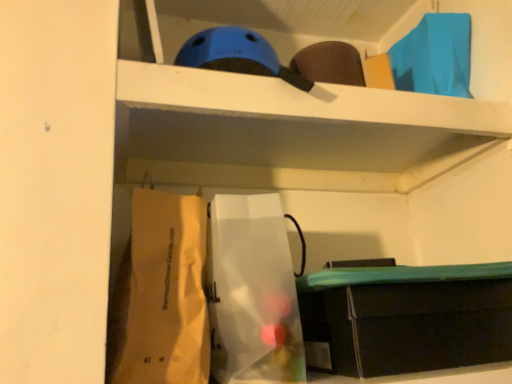
What is the approximate height of matte black storage box at lower right?

It is 5.56 inches.

What is the approximate width of matte black storage box at lower right?

matte black storage box at lower right is 24.27 centimeters in width.

What are the coordinates of `matte black storage box at lower right` in the screenshot? It's located at (406, 318).

Is translucent plastic bag at center, the second paper bag viewed from the left, beside matte black storage box at lower right?

No, translucent plastic bag at center, the second paper bag viewed from the left, is not in contact with matte black storage box at lower right.

Considering the positions of objects translucent plastic bag at center, the first paper bag when ordered from right to left, and matte black storage box at lower right in the image provided, who is more to the right, translucent plastic bag at center, the first paper bag when ordered from right to left, or matte black storage box at lower right?

From the viewer's perspective, matte black storage box at lower right appears more on the right side.

Considering the relative sizes of translucent plastic bag at center, the first paper bag when ordered from right to left, and matte black storage box at lower right in the image provided, is translucent plastic bag at center, the first paper bag when ordered from right to left, thinner than matte black storage box at lower right?

Yes.

How distant is translucent plastic bag at center, the second paper bag viewed from the left, from matte black storage box at lower right?

translucent plastic bag at center, the second paper bag viewed from the left, is 5.32 inches from matte black storage box at lower right.

Is matte black storage box at lower right taller or shorter than white paper bag at lower left, arranged as the 2th paper bag when viewed from the right?

In the image, matte black storage box at lower right appears to be shorter than white paper bag at lower left, arranged as the 2th paper bag when viewed from the right.

Would you say matte black storage box at lower right is a long distance from white paper bag at lower left, marked as the 1th paper bag in a left-to-right arrangement?

matte black storage box at lower right is near white paper bag at lower left, marked as the 1th paper bag in a left-to-right arrangement, not far away.

Is matte black storage box at lower right wider than white paper bag at lower left, marked as the 1th paper bag in a left-to-right arrangement?

Indeed, matte black storage box at lower right has a greater width compared to white paper bag at lower left, marked as the 1th paper bag in a left-to-right arrangement.

Considering the sizes of matte black storage box at lower right and translucent plastic bag at center, the second paper bag viewed from the left, in the image, is matte black storage box at lower right bigger or smaller than translucent plastic bag at center, the second paper bag viewed from the left,?

Considering their sizes, matte black storage box at lower right takes up more space than translucent plastic bag at center, the second paper bag viewed from the left.

How different are the orientations of matte black storage box at lower right and translucent plastic bag at center, the second paper bag viewed from the left, in degrees?

matte black storage box at lower right and translucent plastic bag at center, the second paper bag viewed from the left, are facing 3.41 degrees away from each other.

Starting from the matte black storage box at lower right, which paper bag is the 1st one to the left? Please provide its 2D coordinates.

[(252, 292)]

Which is closer, [356,359] or [262,333]?

Positioned in front is point [262,333].

Where is `paper bag that appears on the left of translucent plastic bag at center, the first paper bag when ordered from right to left`? This screenshot has width=512, height=384. paper bag that appears on the left of translucent plastic bag at center, the first paper bag when ordered from right to left is located at coordinates pyautogui.click(x=160, y=295).

Does white paper bag at lower left, arranged as the 2th paper bag when viewed from the right, touch translucent plastic bag at center, the second paper bag viewed from the left?

Yes, the surface of white paper bag at lower left, arranged as the 2th paper bag when viewed from the right, is in contact with translucent plastic bag at center, the second paper bag viewed from the left.

Is white paper bag at lower left, arranged as the 2th paper bag when viewed from the right, oriented towards translucent plastic bag at center, the first paper bag when ordered from right to left?

No, white paper bag at lower left, arranged as the 2th paper bag when viewed from the right, is not facing towards translucent plastic bag at center, the first paper bag when ordered from right to left.

Is white paper bag at lower left, arranged as the 2th paper bag when viewed from the right, located outside matte black storage box at lower right?

Yes, white paper bag at lower left, arranged as the 2th paper bag when viewed from the right, is not within matte black storage box at lower right.

Would you consider white paper bag at lower left, marked as the 1th paper bag in a left-to-right arrangement, to be distant from matte black storage box at lower right?

That's not correct — white paper bag at lower left, marked as the 1th paper bag in a left-to-right arrangement, is a little close to matte black storage box at lower right.

Between white paper bag at lower left, arranged as the 2th paper bag when viewed from the right, and matte black storage box at lower right, which one has more height?

With more height is white paper bag at lower left, arranged as the 2th paper bag when viewed from the right.

Considering the relative positions of white paper bag at lower left, marked as the 1th paper bag in a left-to-right arrangement, and matte black storage box at lower right in the image provided, is white paper bag at lower left, marked as the 1th paper bag in a left-to-right arrangement, behind matte black storage box at lower right?

No, it is in front of matte black storage box at lower right.

Is translucent plastic bag at center, the second paper bag viewed from the left, to the left of white paper bag at lower left, marked as the 1th paper bag in a left-to-right arrangement, from the viewer's perspective?

No, translucent plastic bag at center, the second paper bag viewed from the left, is not to the left of white paper bag at lower left, marked as the 1th paper bag in a left-to-right arrangement.

What's the angular difference between translucent plastic bag at center, the second paper bag viewed from the left, and white paper bag at lower left, marked as the 1th paper bag in a left-to-right arrangement,'s facing directions?

There is a 0.000636-degree angle between the facing directions of translucent plastic bag at center, the second paper bag viewed from the left, and white paper bag at lower left, marked as the 1th paper bag in a left-to-right arrangement.

Is translucent plastic bag at center, the second paper bag viewed from the left, next to white paper bag at lower left, arranged as the 2th paper bag when viewed from the right?

Yes.

Considering the sizes of translucent plastic bag at center, the first paper bag when ordered from right to left, and white paper bag at lower left, arranged as the 2th paper bag when viewed from the right, in the image, is translucent plastic bag at center, the first paper bag when ordered from right to left, wider or thinner than white paper bag at lower left, arranged as the 2th paper bag when viewed from the right,?

Clearly, translucent plastic bag at center, the first paper bag when ordered from right to left, has more width compared to white paper bag at lower left, arranged as the 2th paper bag when viewed from the right.

Where is `the 1st paper bag directly above the matte black storage box at lower right (from a real-world perspective)`? the 1st paper bag directly above the matte black storage box at lower right (from a real-world perspective) is located at coordinates (252, 292).

Locate an element on the screen. The image size is (512, 384). the 2nd paper bag in front of the matte black storage box at lower right is located at coordinates (160, 295).

Which object lies further to the anchor point translucent plastic bag at center, the second paper bag viewed from the left, matte black storage box at lower right or white paper bag at lower left, marked as the 1th paper bag in a left-to-right arrangement?

Among the two, matte black storage box at lower right is located further to translucent plastic bag at center, the second paper bag viewed from the left.

Consider the image. Considering their positions, is translucent plastic bag at center, the first paper bag when ordered from right to left, positioned closer to matte black storage box at lower right than white paper bag at lower left, marked as the 1th paper bag in a left-to-right arrangement?

translucent plastic bag at center, the first paper bag when ordered from right to left, lies closer to matte black storage box at lower right than the other object.

Consider the image. From the image, which object appears to be farther from translucent plastic bag at center, the second paper bag viewed from the left, white paper bag at lower left, marked as the 1th paper bag in a left-to-right arrangement, or matte black storage box at lower right?

matte black storage box at lower right is positioned further to the anchor translucent plastic bag at center, the second paper bag viewed from the left.

Which object lies further to the anchor point white paper bag at lower left, marked as the 1th paper bag in a left-to-right arrangement, matte black storage box at lower right or translucent plastic bag at center, the second paper bag viewed from the left?

matte black storage box at lower right is further to white paper bag at lower left, marked as the 1th paper bag in a left-to-right arrangement.

Which object lies further to the anchor point matte black storage box at lower right, white paper bag at lower left, arranged as the 2th paper bag when viewed from the right, or translucent plastic bag at center, the first paper bag when ordered from right to left?

white paper bag at lower left, arranged as the 2th paper bag when viewed from the right, is positioned further to the anchor matte black storage box at lower right.

When comparing their distances from white paper bag at lower left, arranged as the 2th paper bag when viewed from the right, does translucent plastic bag at center, the first paper bag when ordered from right to left, or matte black storage box at lower right seem closer?

Among the two, translucent plastic bag at center, the first paper bag when ordered from right to left, is located nearer to white paper bag at lower left, arranged as the 2th paper bag when viewed from the right.

Identify the location of paper bag situated between white paper bag at lower left, arranged as the 2th paper bag when viewed from the right, and matte black storage box at lower right from left to right. (252, 292).